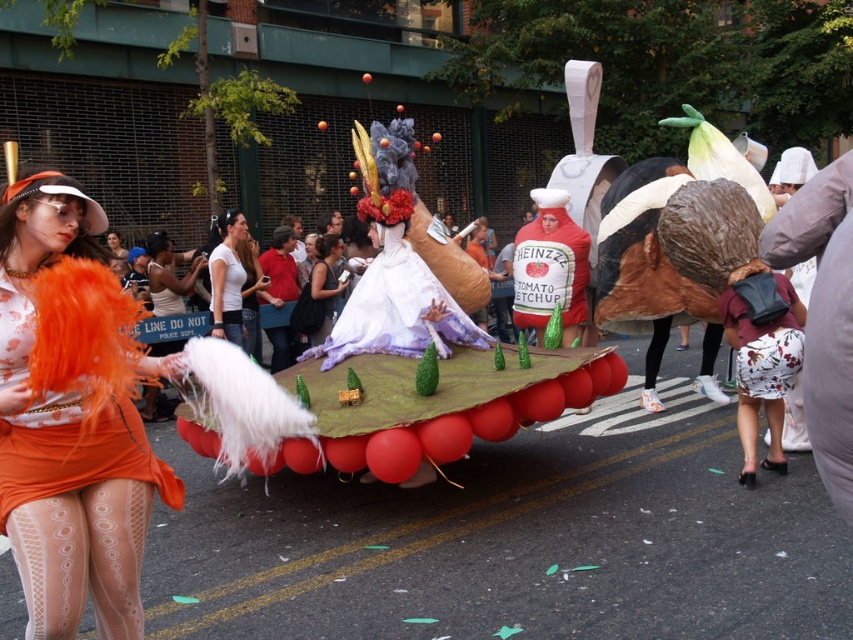
From the picture: Is matte orange dress at left to the right of matte white dress at center from the viewer's perspective?

Indeed, matte orange dress at left is positioned on the right side of matte white dress at center.

What do you see at coordinates (67, 440) in the screenshot?
I see `matte orange dress at left` at bounding box center [67, 440].

Is point (68, 518) less distant than point (308, 292)?

Yes, it is in front of point (308, 292).

Locate an element on the screen. The height and width of the screenshot is (640, 853). matte orange dress at left is located at coordinates pyautogui.click(x=67, y=440).

Which is more to the left, matte orange dress at left or white matte shirt at center?

Positioned to the left is white matte shirt at center.

Does matte orange dress at left have a lesser width compared to white matte shirt at center?

Correct, matte orange dress at left's width is less than white matte shirt at center's.

You are a GUI agent. You are given a task and a screenshot of the screen. Output one action in this format:
    pyautogui.click(x=<x>, y=<y>)
    Task: Click on the matte orange dress at left
    The image size is (853, 640).
    Given the screenshot: What is the action you would take?
    pyautogui.click(x=67, y=440)

Between matte orange dress at left and white fluffy feathers at center, which one has more height?

Standing taller between the two is matte orange dress at left.

Can you confirm if matte orange dress at left is positioned below white fluffy feathers at center?

Indeed, matte orange dress at left is positioned under white fluffy feathers at center.

Does point (38, 339) lie behind point (160, 300)?

No, it is in front of (160, 300).

At what (x,y) coordinates should I click in order to perform the action: click on matte orange dress at left. Please return your answer as a coordinate pair (x, y). Looking at the image, I should click on (67, 440).